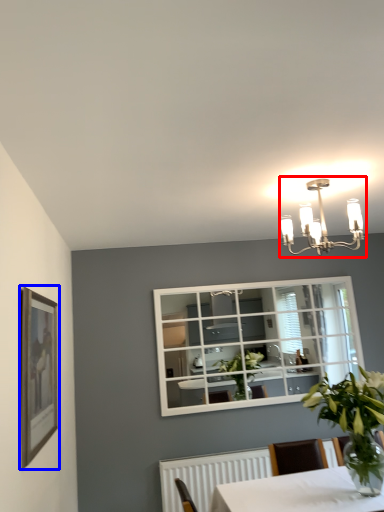
Question: Which of the following is the farthest to the observer, lamp (highlighted by a red box) or picture frame (highlighted by a blue box)?

Choices:
 (A) lamp
 (B) picture frame

Answer: (A)